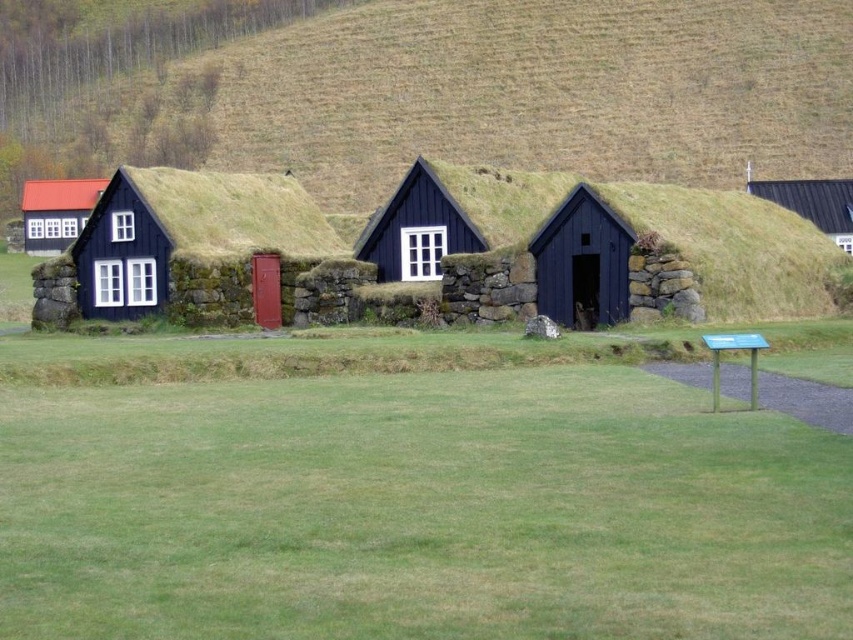
Which is below, green grassy hillside at upper center or black grass-covered cottage at center?

black grass-covered cottage at center is lower down.

Can you confirm if green grassy hillside at upper center is shorter than black grass-covered cottage at center?

No.

At what (x,y) coordinates should I click in order to perform the action: click on green grassy hillside at upper center. Please return your answer as a coordinate pair (x, y). Looking at the image, I should click on (428, 88).

This screenshot has width=853, height=640. What are the coordinates of `green grassy hillside at upper center` in the screenshot? It's located at (428, 88).

Between point (524, 388) and point (355, 248), which one is positioned in front?

Point (524, 388) is more forward.

Does point (679, 624) come in front of point (412, 172)?

That is True.

Identify the location of green grass at center. This screenshot has height=640, width=853. (418, 509).

Who is lower down, green grassy hillside at upper center or matte black cottage at left?

Positioned lower is matte black cottage at left.

Locate an element on the screen. Image resolution: width=853 pixels, height=640 pixels. green grassy hillside at upper center is located at coordinates (428, 88).

Is point (457, 42) less distant than point (80, 209)?

That is False.

Where is `green grassy hillside at upper center`? Image resolution: width=853 pixels, height=640 pixels. green grassy hillside at upper center is located at coordinates (428, 88).